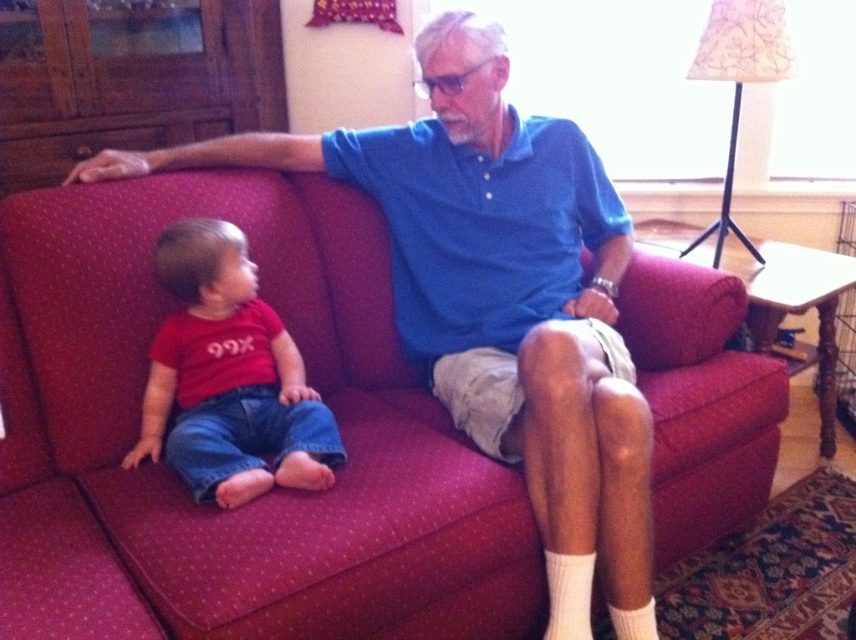
Does matte red shirt at left have a lesser height compared to white cotton sock at lower right?

No, matte red shirt at left is not shorter than white cotton sock at lower right.

Can you confirm if matte red shirt at left is positioned to the left of white cotton sock at lower right?

Yes, matte red shirt at left is to the left of white cotton sock at lower right.

Does point (181, 332) come in front of point (645, 618)?

No.

Identify the location of matte red shirt at left. (229, 378).

Between velvet-like red couch at center and white cotton sock at lower right, which one appears on the right side from the viewer's perspective?

white cotton sock at lower right

Between velvet-like red couch at center and white cotton sock at lower right, which one has less height?

With less height is white cotton sock at lower right.

Which is behind, point (431, 536) or point (629, 614)?

Positioned behind is point (629, 614).

Locate an element on the screen. velvet-like red couch at center is located at coordinates (268, 493).

Does velvet-like red couch at center have a lesser height compared to white ribbed sock at lower right?

No, velvet-like red couch at center is not shorter than white ribbed sock at lower right.

Is point (204, 531) behind point (574, 563)?

No, (204, 531) is closer to viewer.

Where is `velvet-like red couch at center`? This screenshot has width=856, height=640. velvet-like red couch at center is located at coordinates (268, 493).

This screenshot has height=640, width=856. Identify the location of velvet-like red couch at center. (268, 493).